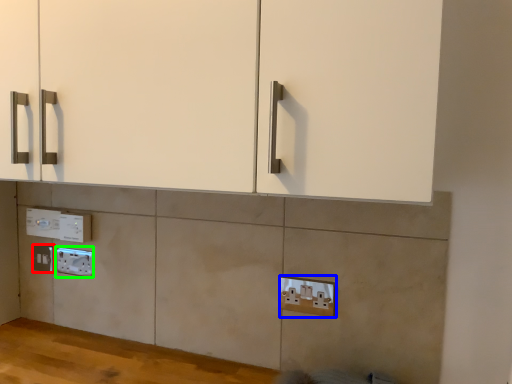
Question: Based on their relative distances, which object is nearer to electric outlet (highlighted by a red box)? Choose from electric outlet (highlighted by a blue box) and electric outlet (highlighted by a green box).

Choices:
 (A) electric outlet
 (B) electric outlet

Answer: (B)